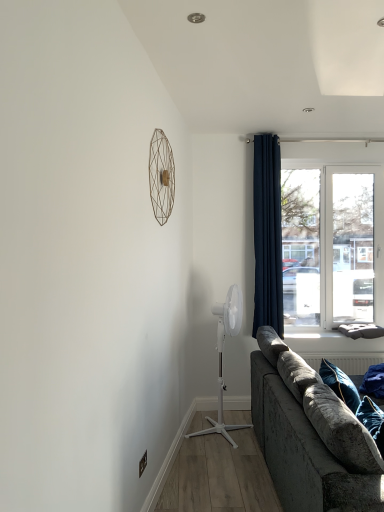
Question: From the image's perspective, is velvet grey couch at lower right located above or below white plastic fan at center, which appears as the 1th mechanical fan when viewed from the back?

Choices:
 (A) below
 (B) above

Answer: (A)

Question: Does point (261, 431) appear closer or farther from the camera than point (225, 325)?

Choices:
 (A) closer
 (B) farther

Answer: (A)

Question: Based on their relative distances, which object is nearer to the white plastic fan at center, which appears as the 1th mechanical fan when viewed from the back?

Choices:
 (A) transparent glass window at upper right
 (B) matte gold wire at upper center, the 2th mechanical fan ordered from the bottom
 (C) velvet grey couch at lower right
 (D) navy blue fabric curtain at right

Answer: (D)

Question: Considering the real-world distances, which object is closest to the navy blue fabric curtain at right?

Choices:
 (A) white plastic fan at center, the 2th mechanical fan viewed from the left
 (B) velvet grey couch at lower right
 (C) matte gold wire at upper center, the 2th mechanical fan ordered from the bottom
 (D) transparent glass window at upper right

Answer: (A)